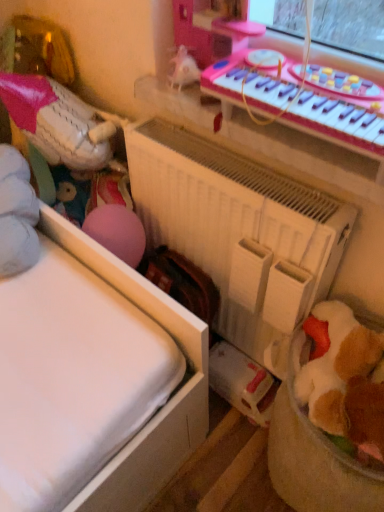
Locate an element on the screen. This screenshot has height=512, width=384. empty space that is ontop of white matte radiator at center is located at coordinates (218, 163).